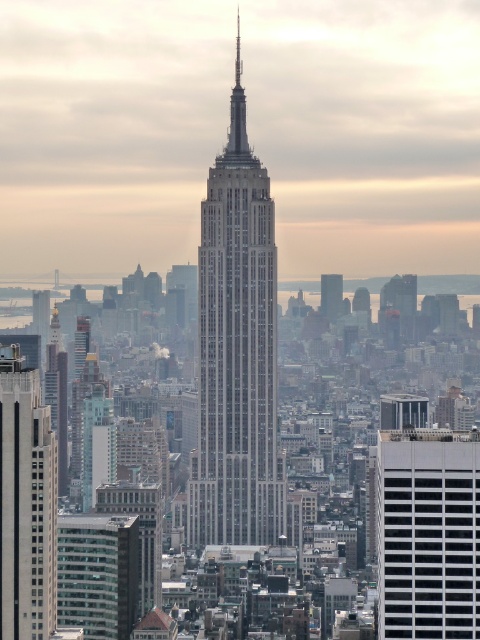
Question: Which point is closer to the camera taking this photo?

Choices:
 (A) (407, 481)
 (B) (71, 524)
 (C) (264, 513)
 (D) (342, 284)

Answer: (D)

Question: Which of the following is the farthest from the observer?

Choices:
 (A) gray stone skyscraper at center
 (B) gray stone skyscraper at left
 (C) white glass building at right
 (D) glassy reflective skyscraper at center

Answer: (D)

Question: Does white glass building at right have a smaller size compared to glassy reflective skyscraper at center?

Choices:
 (A) yes
 (B) no

Answer: (B)

Question: Does gray stone skyscraper at left have a smaller size compared to gray stone skyscraper at center?

Choices:
 (A) no
 (B) yes

Answer: (A)

Question: Is gray stone skyscraper at left thinner than glassy reflective skyscraper at center?

Choices:
 (A) yes
 (B) no

Answer: (A)

Question: Which is farther from the white glass building at right?

Choices:
 (A) gray stone skyscraper at left
 (B) gray stone skyscraper at center
 (C) glassy reflective skyscraper at center
 (D) white marble tower at center

Answer: (A)